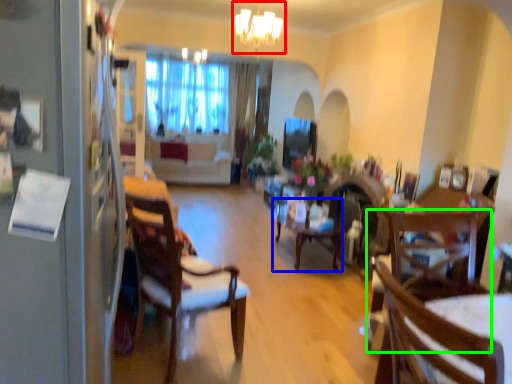
Question: Estimate the real-world distances between objects in this image. Which object is farther from light fixture (highlighted by a red box), table (highlighted by a blue box) or chair (highlighted by a green box)?

Choices:
 (A) table
 (B) chair

Answer: (B)